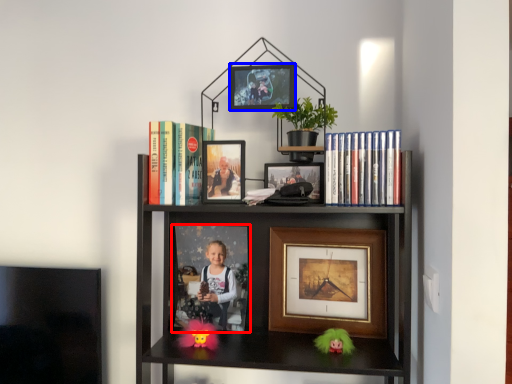
Question: Which object is closer to the camera taking this photo, picture frame (highlighted by a red box) or picture frame (highlighted by a blue box)?

Choices:
 (A) picture frame
 (B) picture frame

Answer: (B)